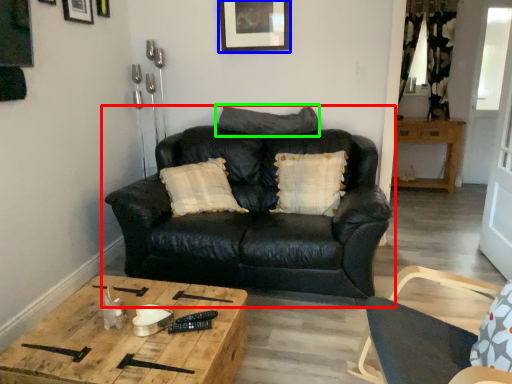
Question: Which is farther away from studio couch (highlighted by a red box)? picture frame (highlighted by a blue box) or pillow (highlighted by a green box)?

Choices:
 (A) picture frame
 (B) pillow

Answer: (A)